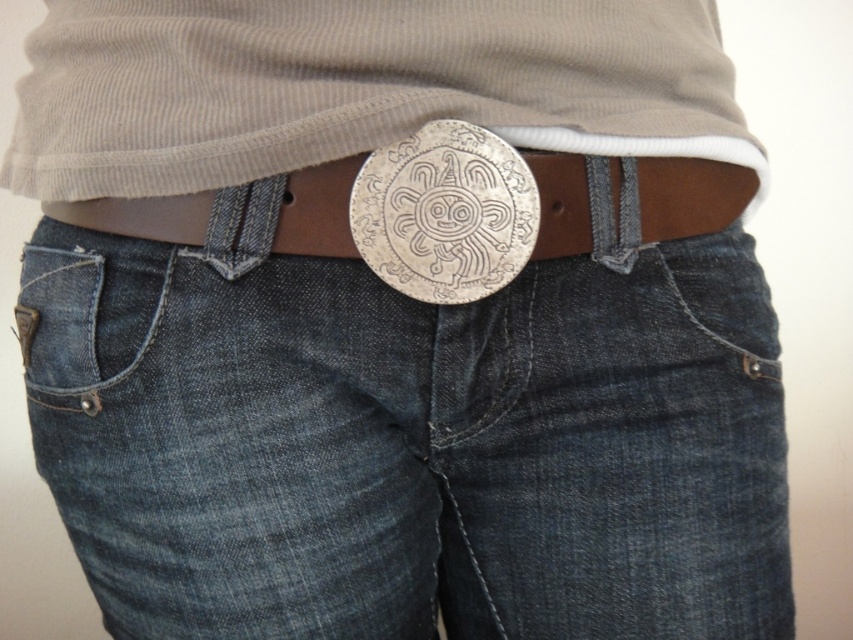
You are a tailor trying to sew a new patch onto the denim at center and the denim pocket at lower left. Which area requires a larger patch to cover the same proportion of the material?

The denim at center requires a larger patch because it is wider than the denim pocket at lower left.